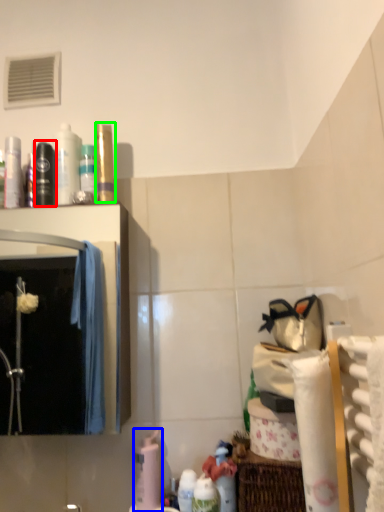
Question: Which is farther away from mouthwash (highlighted by a red box)? cleaning product (highlighted by a blue box) or toiletry (highlighted by a green box)?

Choices:
 (A) cleaning product
 (B) toiletry

Answer: (A)